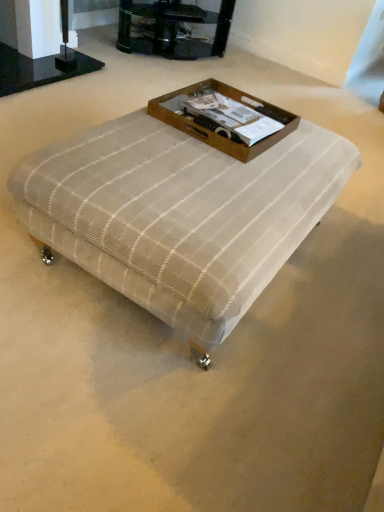
At what (x,y) coordinates should I click in order to perform the action: click on spots to the right of brown wooden tray at center. Please return your answer as a coordinate pair (x, y). Image resolution: width=384 pixels, height=512 pixels. Looking at the image, I should click on (308, 153).